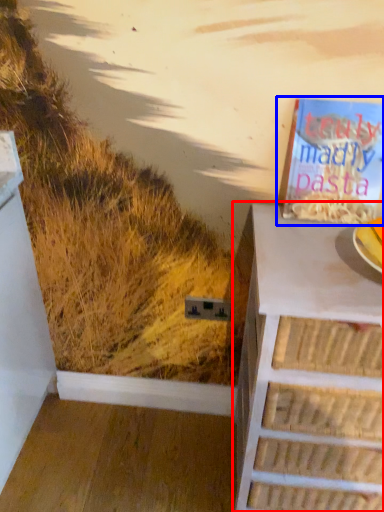
Question: Which point is further to the camera, chest of drawers (highlighted by a red box) or book (highlighted by a blue box)?

Choices:
 (A) chest of drawers
 (B) book

Answer: (B)